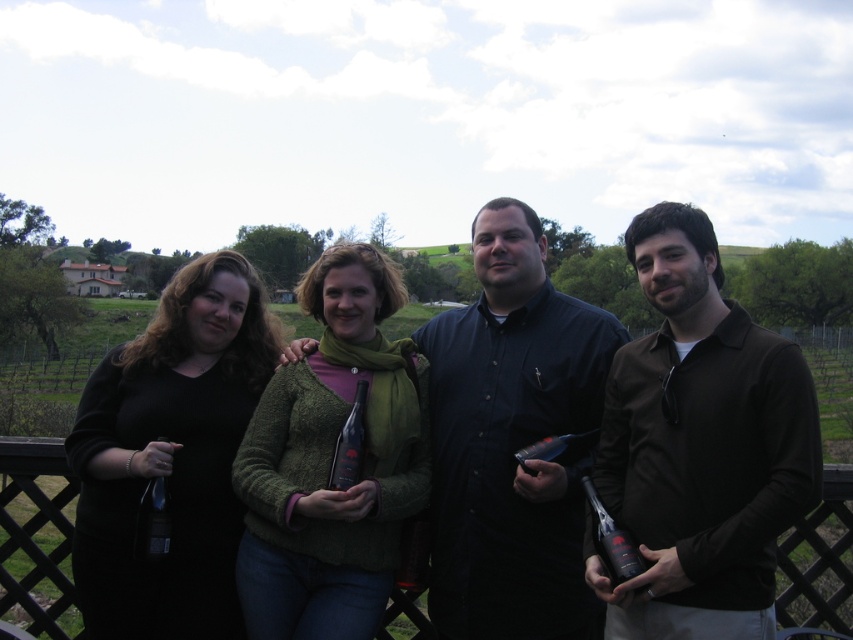
Question: Is the position of brown matte shirt at center more distant than that of matte black bottle at lower right?

Choices:
 (A) no
 (B) yes

Answer: (A)

Question: Is dark blue button-up shirt at center further to the viewer compared to matte glass beer bottle at center?

Choices:
 (A) no
 (B) yes

Answer: (B)

Question: Among these objects, which one is farthest from the camera?

Choices:
 (A) brown matte shirt at center
 (B) matte glass beer bottle at center
 (C) dark blue button-up shirt at center
 (D) green knitted sweater at center

Answer: (C)

Question: Which point is closer to the camera taking this photo?

Choices:
 (A) (334, 474)
 (B) (672, 204)
 (C) (614, 540)
 (D) (175, 404)

Answer: (C)

Question: Can you confirm if dark blue button-up shirt at center is bigger than green knitted sweater at center?

Choices:
 (A) yes
 (B) no

Answer: (A)

Question: Which object is positioned farthest from the brown matte shirt at center?

Choices:
 (A) green knitted sweater at center
 (B) dark blue button-up shirt at center
 (C) matte glass beer bottle at center

Answer: (A)